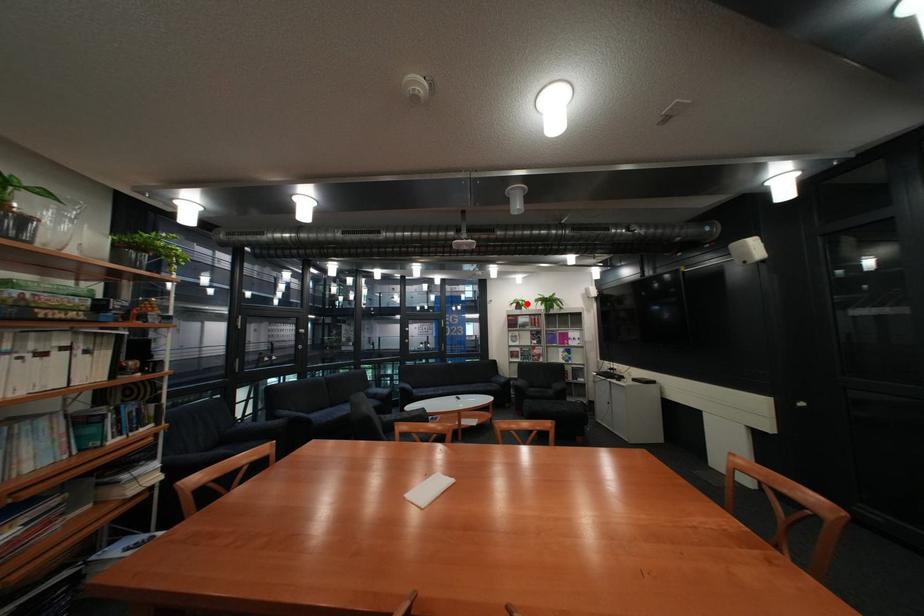
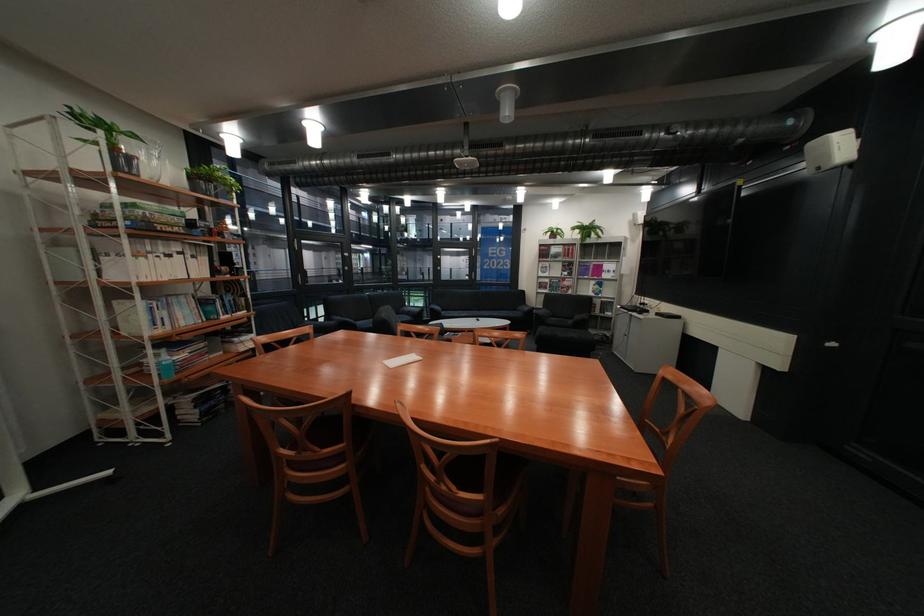
Question: I am providing you with two images of the same scene from different viewpoints. A red point is shown in image1. For the corresponding object point in image2, is it positioned nearer or farther from the camera?

Choices:
 (A) Nearer
 (B) Farther

Answer: (A)